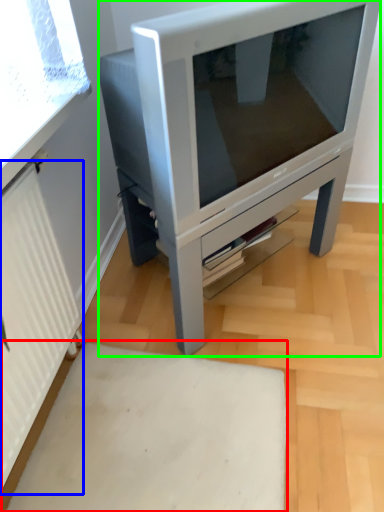
Question: Based on their relative distances, which object is nearer to plain (highlighted by a red box)? Choose from radiator (highlighted by a blue box) and furniture (highlighted by a green box).

Choices:
 (A) radiator
 (B) furniture

Answer: (A)